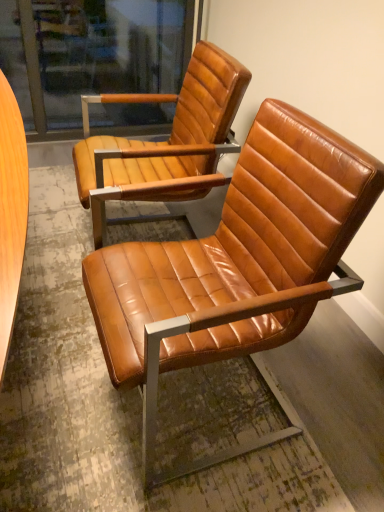
Question: Which direction should I rotate to look at cognac leather chair at center, the 2th chair viewed from the back?

Choices:
 (A) left
 (B) right

Answer: (B)

Question: Is cognac leather chair at center, the 2th chair viewed from the back, at the right side of cognac leather chair at center, positioned as the 2th chair in front-to-back order?

Choices:
 (A) yes
 (B) no

Answer: (A)

Question: Is cognac leather chair at center, the 2th chair viewed from the back, behind cognac leather chair at center, which appears as the first chair when viewed from the back?

Choices:
 (A) no
 (B) yes

Answer: (A)

Question: Is cognac leather chair at center, which appears as the 1th chair when viewed from the front, bigger than cognac leather chair at center, positioned as the 2th chair in front-to-back order?

Choices:
 (A) no
 (B) yes

Answer: (B)

Question: From a real-world perspective, is cognac leather chair at center, the 2th chair viewed from the back, located beneath cognac leather chair at center, positioned as the 2th chair in front-to-back order?

Choices:
 (A) yes
 (B) no

Answer: (B)

Question: Is cognac leather chair at center, the 2th chair viewed from the back, with cognac leather chair at center, which appears as the first chair when viewed from the back?

Choices:
 (A) yes
 (B) no

Answer: (B)

Question: Considering the relative sizes of cognac leather chair at center, which appears as the 1th chair when viewed from the front, and cognac leather chair at center, which appears as the first chair when viewed from the back, in the image provided, is cognac leather chair at center, which appears as the 1th chair when viewed from the front, wider than cognac leather chair at center, which appears as the first chair when viewed from the back,?

Choices:
 (A) no
 (B) yes

Answer: (B)

Question: Can you confirm if cognac leather chair at center, which appears as the first chair when viewed from the back, is smaller than cognac leather chair at center, the 2th chair viewed from the back?

Choices:
 (A) no
 (B) yes

Answer: (B)

Question: Can you confirm if cognac leather chair at center, which appears as the first chair when viewed from the back, is positioned to the left of cognac leather chair at center, the 2th chair viewed from the back?

Choices:
 (A) yes
 (B) no

Answer: (A)

Question: Is cognac leather chair at center, which appears as the first chair when viewed from the back, further to camera compared to cognac leather chair at center, which appears as the 1th chair when viewed from the front?

Choices:
 (A) yes
 (B) no

Answer: (A)

Question: From a real-world perspective, does cognac leather chair at center, positioned as the 2th chair in front-to-back order, sit lower than cognac leather chair at center, which appears as the 1th chair when viewed from the front?

Choices:
 (A) no
 (B) yes

Answer: (B)

Question: Is cognac leather chair at center, positioned as the 2th chair in front-to-back order, placed right next to cognac leather chair at center, which appears as the 1th chair when viewed from the front?

Choices:
 (A) yes
 (B) no

Answer: (B)

Question: Is cognac leather chair at center, positioned as the 2th chair in front-to-back order, shorter than cognac leather chair at center, the 2th chair viewed from the back?

Choices:
 (A) yes
 (B) no

Answer: (A)

Question: Is cognac leather chair at center, the 2th chair viewed from the back, in front of or behind cognac leather chair at center, positioned as the 2th chair in front-to-back order, in the image?

Choices:
 (A) behind
 (B) front

Answer: (B)